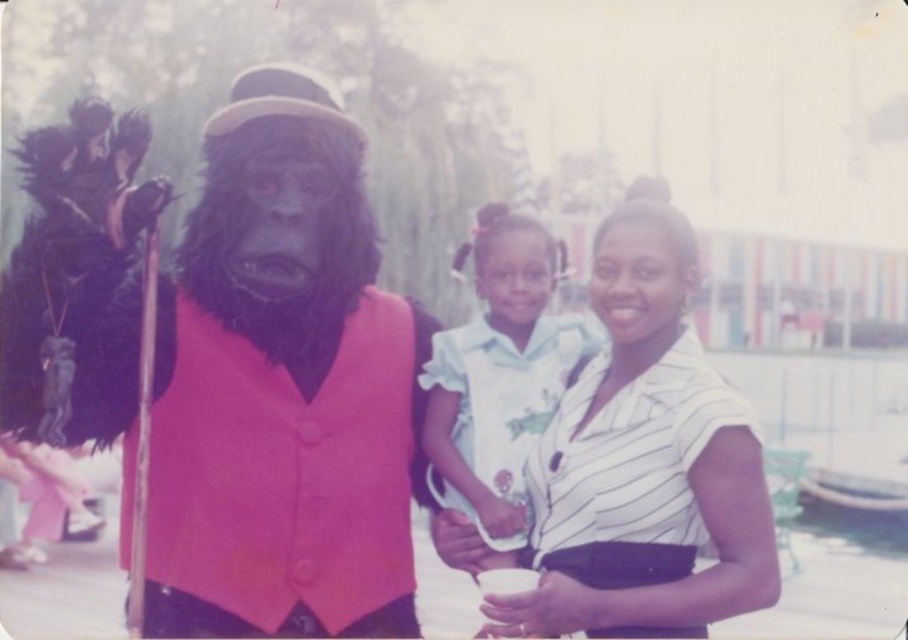
Is point (608, 481) behind point (482, 436)?

No.

Does white striped shirt at center have a smaller size compared to white cotton dress at center?

No.

Is point (708, 477) in front of point (563, 316)?

Yes, point (708, 477) is closer to viewer.

I want to click on white striped shirt at center, so click(x=644, y=461).

Does velvet pink vest at center have a lesser height compared to white striped shirt at center?

No, velvet pink vest at center is not shorter than white striped shirt at center.

In the scene shown: Can you confirm if velvet pink vest at center is wider than white striped shirt at center?

Yes, velvet pink vest at center is wider than white striped shirt at center.

Find the location of a particular element. velvet pink vest at center is located at coordinates (284, 388).

You are a GUI agent. You are given a task and a screenshot of the screen. Output one action in this format:
    pyautogui.click(x=<x>, y=<y>)
    Task: Click on the velvet pink vest at center
    This screenshot has width=908, height=640.
    Given the screenshot: What is the action you would take?
    pyautogui.click(x=284, y=388)

Is velvet pink vest at center bigger than white cotton dress at center?

Yes.

Which is more to the right, velvet pink vest at center or white cotton dress at center?

Positioned to the right is white cotton dress at center.

In order to click on velvet pink vest at center in this screenshot , I will do `click(284, 388)`.

This screenshot has height=640, width=908. I want to click on velvet pink vest at center, so click(284, 388).